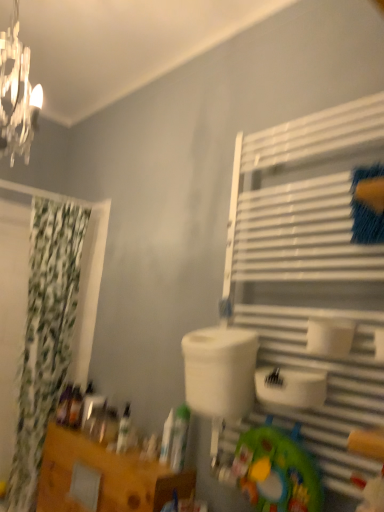
This screenshot has width=384, height=512. What do you see at coordinates (75, 408) in the screenshot?
I see `translucent plastic bottle at lower left, the fourth toiletry positioned from the front` at bounding box center [75, 408].

The height and width of the screenshot is (512, 384). Identify the location of white matte bottle at lower left, placed as the 3th toiletry when sorted from back to front. (124, 430).

What is the approximate height of wooden table at lower left?

It is 18.48 inches.

The height and width of the screenshot is (512, 384). I want to click on translucent plastic bottle at lower left, which is the 2th toiletry in back-to-front order, so click(75, 408).

Locate an element on the screen. The width and height of the screenshot is (384, 512). the 3rd toiletry directly beneath the green fabric curtain at left (from a real-world perspective) is located at coordinates (167, 438).

Which object is closer to the camera, green fabric curtain at left or white matte bottle at center, the 4th toiletry positioned from the back?

→ white matte bottle at center, the 4th toiletry positioned from the back, is in front.

Does green fabric curtain at left contain white matte bottle at center, the 4th toiletry when ordered from left to right?

No, white matte bottle at center, the 4th toiletry when ordered from left to right, is not surrounded by green fabric curtain at left.

In terms of width, does green fabric curtain at left look wider or thinner when compared to white matte bottle at center, acting as the second toiletry starting from the right?

In the image, green fabric curtain at left appears to be wider than white matte bottle at center, acting as the second toiletry starting from the right.

Does white matte toilet paper at center-right turn towards translucent plastic bottle at lower left, the fifth toiletry from the right?

No, white matte toilet paper at center-right does not turn towards translucent plastic bottle at lower left, the fifth toiletry from the right.

Consider the image. Is white matte toilet paper at center-right inside the boundaries of translucent plastic bottle at lower left, the fifth toiletry from the right, or outside?

white matte toilet paper at center-right is not enclosed by translucent plastic bottle at lower left, the fifth toiletry from the right.

From the image's perspective, which is above, white matte toilet paper at center-right or translucent plastic bottle at lower left, the fifth toiletry from the right?

From the image's view, white matte toilet paper at center-right is above.

From the picture: How many degrees apart are the facing directions of translucent plastic bottle at lower left, marked as the 1th toiletry in a left-to-right arrangement, and wooden table at lower left?

There is a 16.7-degree angle between the facing directions of translucent plastic bottle at lower left, marked as the 1th toiletry in a left-to-right arrangement, and wooden table at lower left.

Is translucent plastic bottle at lower left, which ranks as the first toiletry in back-to-front order, not within wooden table at lower left?

That's correct, translucent plastic bottle at lower left, which ranks as the first toiletry in back-to-front order, is outside of wooden table at lower left.

Is translucent plastic bottle at lower left, the fifth toiletry from the right, turned away from wooden table at lower left?

No, translucent plastic bottle at lower left, the fifth toiletry from the right, is not facing away from wooden table at lower left.

Which object is wider, white matte bottle at center, the 4th toiletry positioned from the back, or white matte toilet paper at center-right?

white matte toilet paper at center-right.

Which is farther from the camera, (x=171, y=409) or (x=317, y=325)?

Positioned behind is point (x=171, y=409).

Which object is closer to the camera, white matte bottle at center, the 4th toiletry positioned from the back, or white matte toilet paper at center-right?

white matte toilet paper at center-right is closer to the camera.

Between white matte bottle at center, acting as the second toiletry starting from the right, and white matte toilet paper at center-right, which one has smaller size?

With smaller size is white matte bottle at center, acting as the second toiletry starting from the right.

Which is more to the left, green fabric curtain at left or translucent plastic bottle at lower left, which ranks as the 2th toiletry in left-to-right order?

From the viewer's perspective, green fabric curtain at left appears more on the left side.

Does green fabric curtain at left turn towards translucent plastic bottle at lower left, which is the 2th toiletry in back-to-front order?

Yes, green fabric curtain at left is facing translucent plastic bottle at lower left, which is the 2th toiletry in back-to-front order.

From a real-world perspective, is green fabric curtain at left beneath translucent plastic bottle at lower left, which ranks as the 2th toiletry in left-to-right order?

No.

Locate an element on the screen. the 3rd toiletry below the white metal shelf at right (from the image's perspective) is located at coordinates (124, 430).

From the image's perspective, is white metal shelf at right under white matte bottle at lower left, placed as the 3th toiletry when sorted from back to front?

No, from the image's perspective, white metal shelf at right is not beneath white matte bottle at lower left, placed as the 3th toiletry when sorted from back to front.

Is white metal shelf at right at the right side of white matte bottle at lower left, placed as the third toiletry when sorted from right to left?

Correct, you'll find white metal shelf at right to the right of white matte bottle at lower left, placed as the third toiletry when sorted from right to left.

Can you see white metal shelf at right touching white matte bottle at lower left, marked as the 3th toiletry in a left-to-right arrangement?

They are not placed beside each other.

From the image's perspective, is translucent plastic bottle at lower left, which is the 2th toiletry in back-to-front order, located above white metal shelf at right?

Incorrect, from the image's perspective, translucent plastic bottle at lower left, which is the 2th toiletry in back-to-front order, is lower than white metal shelf at right.

Which is more to the right, translucent plastic bottle at lower left, the fourth toiletry positioned from the front, or white metal shelf at right?

Positioned to the right is white metal shelf at right.

Between translucent plastic bottle at lower left, which ranks as the 2th toiletry in left-to-right order, and white metal shelf at right, which one has smaller width?

Thinner between the two is translucent plastic bottle at lower left, which ranks as the 2th toiletry in left-to-right order.

Considering the points (80, 422) and (297, 328), which point is in front, point (80, 422) or point (297, 328)?

The point (297, 328) is closer to the camera.

Which toiletry is the 4th one when counting from the right side of the green fabric curtain at left? Please provide its 2D coordinates.

[(167, 438)]

This screenshot has height=512, width=384. What are the coordinates of `the 5th toiletry behind the white matte toilet paper at center-right, counting from the anchor's position` in the screenshot? It's located at (64, 405).

Which object lies further to the anchor point white metal shelf at right, translucent plastic bottle at lower left, which ranks as the first toiletry in back-to-front order, or white matte bottle at lower left, marked as the 3th toiletry in a left-to-right arrangement?

Based on the image, translucent plastic bottle at lower left, which ranks as the first toiletry in back-to-front order, appears to be further to white metal shelf at right.

When comparing their distances from wooden table at lower left, does translucent plastic bottle at lower left, marked as the 1th toiletry in a left-to-right arrangement, or white matte bottle at lower left, placed as the third toiletry when sorted from right to left, seem closer?

white matte bottle at lower left, placed as the third toiletry when sorted from right to left, is positioned closer to the anchor wooden table at lower left.

Estimate the real-world distances between objects in this image. Which object is further from green fabric curtain at left, translucent plastic bottle at lower left, which is counted as the 5th toiletry, starting from the front, or translucent plastic bottle at lower left, the fourth toiletry positioned from the front?

translucent plastic bottle at lower left, the fourth toiletry positioned from the front, is positioned further to the anchor green fabric curtain at left.

From the image, which object appears to be nearer to white matte bottle at center, the 4th toiletry when ordered from left to right, plastic green toy at lower center or green fabric curtain at left?

plastic green toy at lower center is closer to white matte bottle at center, the 4th toiletry when ordered from left to right.

When comparing their distances from white metal shelf at right, does white matte bottle at center, the 4th toiletry when ordered from left to right, or translucent plastic bottle at lower left, which is counted as the 5th toiletry, starting from the front, seem further?

Based on the image, translucent plastic bottle at lower left, which is counted as the 5th toiletry, starting from the front, appears to be further to white metal shelf at right.

Looking at the image, which one is located further to white metal shelf at right, white matte bottle at lower left, placed as the third toiletry when sorted from front to back, or wooden table at lower left?

The object further to white metal shelf at right is white matte bottle at lower left, placed as the third toiletry when sorted from front to back.

Considering their positions, is white metal shelf at right positioned further to translucent plastic bottle at lower left, the fifth toiletry from the right, than white matte bottle at center, the 4th toiletry positioned from the back?

The object further to translucent plastic bottle at lower left, the fifth toiletry from the right, is white metal shelf at right.

Consider the image. Considering their positions, is white matte bottle at center, which is the second toiletry in front-to-back order, positioned further to white matte tube at center, the 1th toiletry when ordered from right to left, than plastic green toy at lower center?

plastic green toy at lower center is further to white matte tube at center, the 1th toiletry when ordered from right to left.

You are a GUI agent. You are given a task and a screenshot of the screen. Output one action in this format:
    pyautogui.click(x=<x>, y=<y>)
    Task: Click on the furniture between green fabric curtain at left and white matte toilet paper at center-right from left to right
    This screenshot has width=384, height=512.
    Given the screenshot: What is the action you would take?
    coord(106,476)

You are a GUI agent. You are given a task and a screenshot of the screen. Output one action in this format:
    pyautogui.click(x=<x>, y=<y>)
    Task: Click on the furniture between plastic green toy at lower center and white matte bottle at lower left, placed as the third toiletry when sorted from right to left, along the z-axis
    The width and height of the screenshot is (384, 512).
    Given the screenshot: What is the action you would take?
    pyautogui.click(x=106, y=476)

Where is `toilet paper located between plastic green toy at lower center and translucent plastic bottle at lower left, marked as the 1th toiletry in a left-to-right arrangement, in the depth direction`? toilet paper located between plastic green toy at lower center and translucent plastic bottle at lower left, marked as the 1th toiletry in a left-to-right arrangement, in the depth direction is located at coordinates (330, 336).

Locate an element on the screen. The height and width of the screenshot is (512, 384). curtain positioned between wooden table at lower left and translucent plastic bottle at lower left, which is the 2th toiletry in back-to-front order, from near to far is located at coordinates (45, 336).